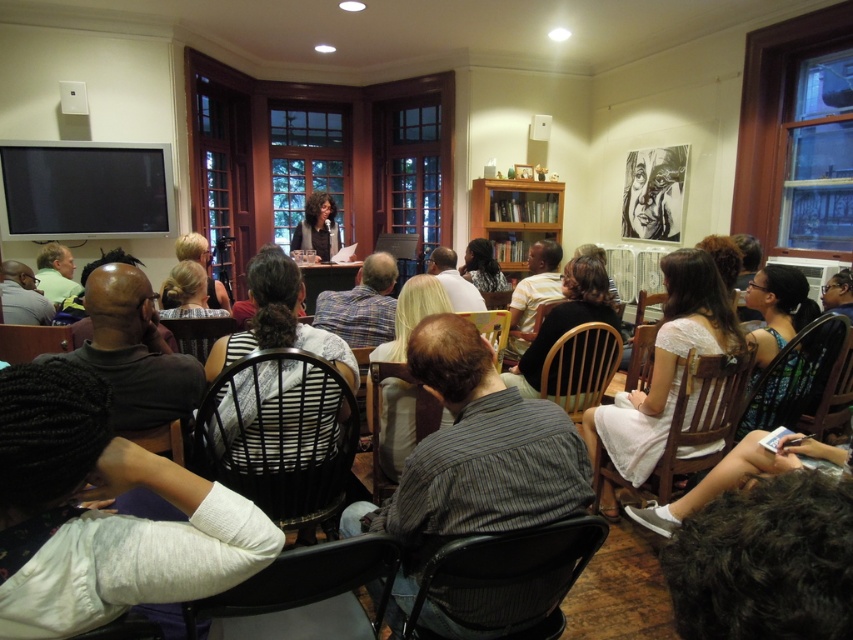
Question: Is wooden bookshelf at center smaller than black ink drawing of a face at upper right?

Choices:
 (A) yes
 (B) no

Answer: (B)

Question: Does white jersey at center appear over wooden bookshelf at center?

Choices:
 (A) no
 (B) yes

Answer: (A)

Question: Which object is the farthest from the white jersey at center?

Choices:
 (A) matte black dress at center
 (B) black ink drawing of a face at upper right
 (C) wooden bookshelf at center

Answer: (C)

Question: Which of the following is the farthest from the observer?

Choices:
 (A) black ink drawing of a face at upper right
 (B) matte black dress at center
 (C) striped fabric shirt at center
 (D) wooden chair at center

Answer: (B)

Question: Does white jersey at center appear on the right side of matte black dress at center?

Choices:
 (A) no
 (B) yes

Answer: (B)

Question: Based on their relative distances, which object is farther from the black ink drawing of a face at upper right?

Choices:
 (A) white jersey at center
 (B) striped fabric shirt at center

Answer: (A)